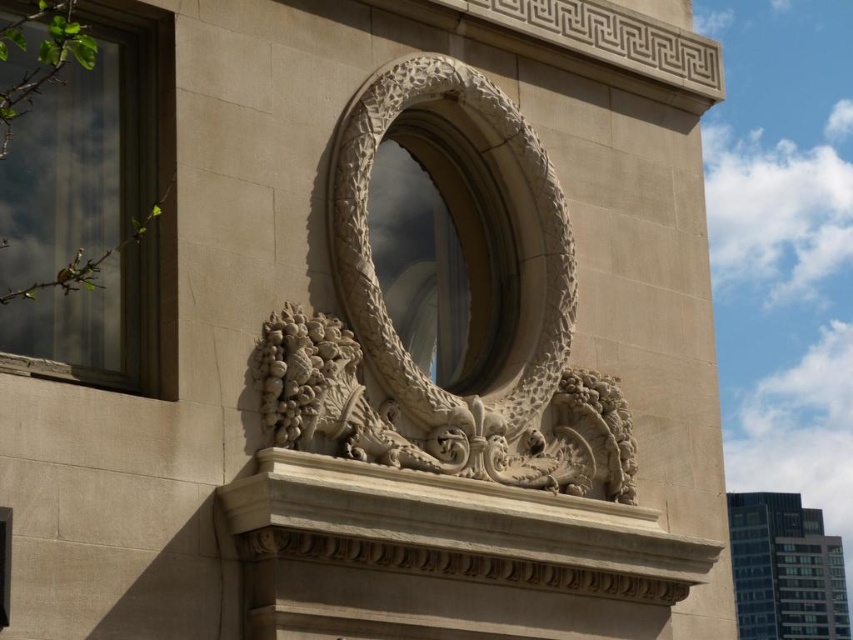
Can you confirm if white stone dragon at center is positioned below clear glass window at upper left?

Indeed, white stone dragon at center is positioned under clear glass window at upper left.

Is point (292, 310) positioned behind point (64, 141)?

Yes, it is.

The height and width of the screenshot is (640, 853). I want to click on white stone dragon at center, so click(471, 308).